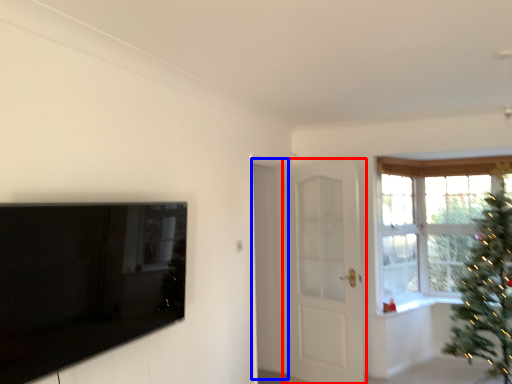
Question: Among these objects, which one is nearest to the camera, door (highlighted by a red box) or screen door (highlighted by a blue box)?

Choices:
 (A) door
 (B) screen door

Answer: (B)